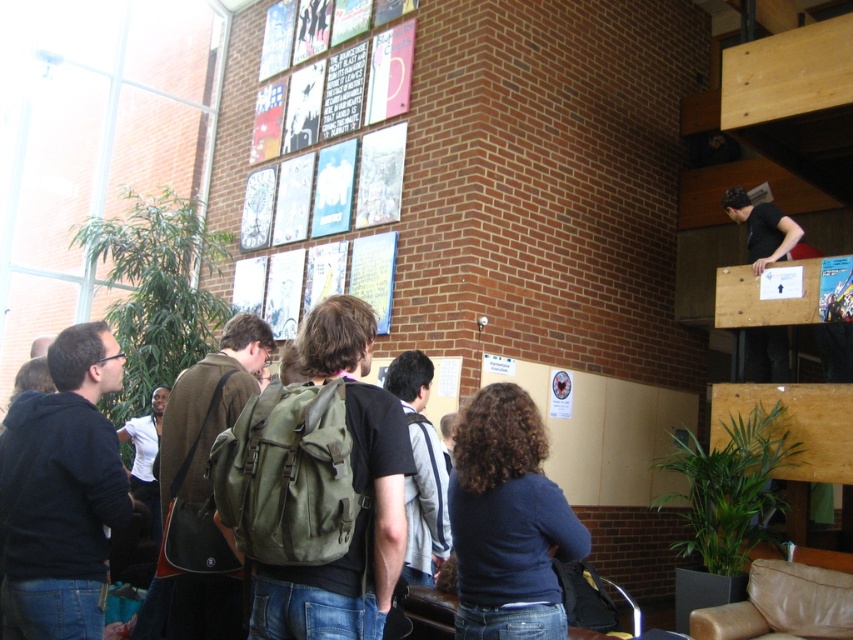
Question: Does matte paper posters at upper center appear on the right side of dark blue hoodie at center?

Choices:
 (A) no
 (B) yes

Answer: (B)

Question: Which point appears farthest from the camera in this image?

Choices:
 (A) (456, 518)
 (B) (380, 61)
 (C) (3, 580)

Answer: (B)

Question: Does blue glossy poster at upper center have a smaller size compared to white paper at upper center?

Choices:
 (A) yes
 (B) no

Answer: (B)

Question: Which point is closer to the camera taking this photo?

Choices:
 (A) (796, 268)
 (B) (380, 54)
 (C) (842, 312)
 (D) (312, 545)

Answer: (D)

Question: Is the position of dark blue shirt at center less distant than that of white paper at upper center?

Choices:
 (A) no
 (B) yes

Answer: (B)

Question: Which point is closer to the camera taking this photo?

Choices:
 (A) (270, 99)
 (B) (485, 481)
 (C) (361, 504)

Answer: (C)